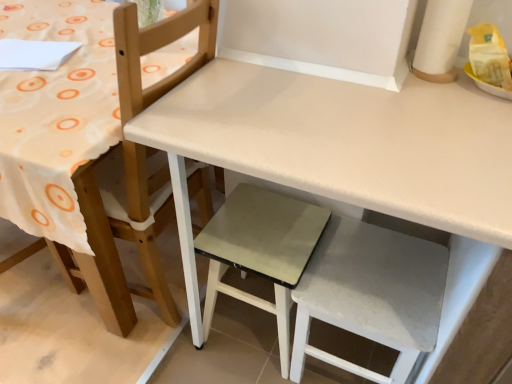
The height and width of the screenshot is (384, 512). In order to click on white fabric step stool at lower right, the 1th step stool from the right in this screenshot , I will do `click(371, 294)`.

Locate an element on the screen. This screenshot has width=512, height=384. matte gray step stool at center, acting as the second step stool starting from the right is located at coordinates [261, 250].

Locate an element on the screen. white matte table at center is located at coordinates (358, 145).

Identify the location of white fabric step stool at lower right, the 1th step stool from the right. The height and width of the screenshot is (384, 512). (371, 294).

Measure the distance from white matte chair at upper left to white matte table at center.

white matte chair at upper left is 14.92 inches from white matte table at center.

How different are the orientations of white matte chair at upper left and white matte table at center in degrees?

88.1 degrees separate the facing orientations of white matte chair at upper left and white matte table at center.

Who is bigger, white matte chair at upper left or white matte table at center?

white matte table at center is bigger.

Which of these two, white matte chair at upper left or white matte table at center, stands shorter?

Standing shorter between the two is white matte table at center.

From the image's perspective, does white matte table at center appear higher than white fabric step stool at lower right, the 1th step stool from the right?

Yes, from the image's perspective, white matte table at center is over white fabric step stool at lower right, the 1th step stool from the right.

Does white matte table at center turn towards white fabric step stool at lower right, the 1th step stool from the right?

Yes, white matte table at center is aimed at white fabric step stool at lower right, the 1th step stool from the right.

How much distance is there between white matte table at center and white fabric step stool at lower right, the 1th step stool from the right?

white matte table at center is 13.95 inches away from white fabric step stool at lower right, the 1th step stool from the right.

Does point (187, 141) come farther from viewer compared to point (292, 294)?

No, (187, 141) is closer to viewer.

Is white fabric step stool at lower right, the 1th step stool from the right, looking in the opposite direction of white matte chair at upper left?

No, white fabric step stool at lower right, the 1th step stool from the right,'s orientation is not away from white matte chair at upper left.

Between white fabric step stool at lower right, placed as the second step stool when sorted from left to right, and white matte chair at upper left, which one has larger size?

Bigger between the two is white matte chair at upper left.

From the picture: Would you say white matte chair at upper left is part of white fabric step stool at lower right, placed as the second step stool when sorted from left to right,'s contents?

No, white matte chair at upper left is not surrounded by white fabric step stool at lower right, placed as the second step stool when sorted from left to right.

Can you confirm if white fabric step stool at lower right, placed as the second step stool when sorted from left to right, is thinner than white matte chair at upper left?

Yes, white fabric step stool at lower right, placed as the second step stool when sorted from left to right, is thinner than white matte chair at upper left.

From the image's perspective, is white matte table at center positioned above or below white matte chair at upper left?

white matte table at center is situated lower than white matte chair at upper left in the image.

Considering the relative sizes of white matte table at center and white matte chair at upper left in the image provided, is white matte table at center thinner than white matte chair at upper left?

Incorrect, the width of white matte table at center is not less than that of white matte chair at upper left.

Can you confirm if white matte table at center is smaller than white matte chair at upper left?

Incorrect, white matte table at center is not smaller in size than white matte chair at upper left.

Is white matte table at center to the left or to the right of white matte chair at upper left in the image?

white matte table at center is to the right of white matte chair at upper left.

Is white matte chair at upper left facing away from matte gray step stool at center, which is the first step stool in left-to-right order?

Absolutely, white matte chair at upper left is directed away from matte gray step stool at center, which is the first step stool in left-to-right order.

Is white matte chair at upper left to the left or to the right of matte gray step stool at center, acting as the second step stool starting from the right, in the image?

From the image, it's evident that white matte chair at upper left is to the left of matte gray step stool at center, acting as the second step stool starting from the right.

How different are the orientations of white matte chair at upper left and matte gray step stool at center, which is the first step stool in left-to-right order, in degrees?

The facing directions of white matte chair at upper left and matte gray step stool at center, which is the first step stool in left-to-right order, are 87.9 degrees apart.

From a real-world perspective, which is physically above, white matte chair at upper left or matte gray step stool at center, acting as the second step stool starting from the right?

white matte chair at upper left is physically above.

Which of these two, white fabric step stool at lower right, the 1th step stool from the right, or matte gray step stool at center, acting as the second step stool starting from the right, stands taller?

Standing taller between the two is matte gray step stool at center, acting as the second step stool starting from the right.

Does white fabric step stool at lower right, the 1th step stool from the right, contain matte gray step stool at center, which is the first step stool in left-to-right order?

No.

Can you see white fabric step stool at lower right, placed as the second step stool when sorted from left to right, touching matte gray step stool at center, acting as the second step stool starting from the right?

No, white fabric step stool at lower right, placed as the second step stool when sorted from left to right, is not next to matte gray step stool at center, acting as the second step stool starting from the right.

Is point (386, 380) positioned in front of point (201, 253)?

Yes, point (386, 380) is in front of point (201, 253).

From a real-world perspective, relative to white matte chair at upper left, is matte gray step stool at center, which is the first step stool in left-to-right order, vertically above or below?

From a real-world perspective, matte gray step stool at center, which is the first step stool in left-to-right order, is physically below white matte chair at upper left.

Is matte gray step stool at center, acting as the second step stool starting from the right, thinner than white matte chair at upper left?

Correct, the width of matte gray step stool at center, acting as the second step stool starting from the right, is less than that of white matte chair at upper left.

Which object is positioned more to the left, matte gray step stool at center, which is the first step stool in left-to-right order, or white matte chair at upper left?

white matte chair at upper left is more to the left.

From the image's perspective, which one is positioned lower, matte gray step stool at center, which is the first step stool in left-to-right order, or white matte chair at upper left?

matte gray step stool at center, which is the first step stool in left-to-right order, from the image's perspective.

Identify the location of table that appears below the white matte chair at upper left (from the image's perspective). (358, 145).

In order to click on the 1st step stool behind the white matte table at center in this screenshot , I will do `click(371, 294)`.

Estimate the real-world distances between objects in this image. Which object is closer to white fabric step stool at lower right, the 1th step stool from the right, white matte table at center or matte gray step stool at center, acting as the second step stool starting from the right?

matte gray step stool at center, acting as the second step stool starting from the right.

Which object lies nearer to the anchor point white matte chair at upper left, white matte table at center or white fabric step stool at lower right, placed as the second step stool when sorted from left to right?

Based on the image, white matte table at center appears to be nearer to white matte chair at upper left.

From the image, which object appears to be nearer to white matte chair at upper left, white fabric step stool at lower right, placed as the second step stool when sorted from left to right, or white matte table at center?

white matte table at center is positioned closer to the anchor white matte chair at upper left.

Looking at the image, which one is located further to white matte table at center, white matte chair at upper left or white fabric step stool at lower right, the 1th step stool from the right?

Based on the image, white matte chair at upper left appears to be further to white matte table at center.

Which object lies nearer to the anchor point matte gray step stool at center, acting as the second step stool starting from the right, white matte table at center or white matte chair at upper left?

Among the two, white matte chair at upper left is located nearer to matte gray step stool at center, acting as the second step stool starting from the right.

When comparing their distances from white fabric step stool at lower right, the 1th step stool from the right, does white matte chair at upper left or matte gray step stool at center, acting as the second step stool starting from the right, seem further?

The object further to white fabric step stool at lower right, the 1th step stool from the right, is white matte chair at upper left.

Looking at the image, which one is located further to matte gray step stool at center, acting as the second step stool starting from the right, white matte chair at upper left or white fabric step stool at lower right, the 1th step stool from the right?

white matte chair at upper left is positioned further to the anchor matte gray step stool at center, acting as the second step stool starting from the right.

When comparing their distances from white matte table at center, does white fabric step stool at lower right, the 1th step stool from the right, or white matte chair at upper left seem closer?

white fabric step stool at lower right, the 1th step stool from the right, lies closer to white matte table at center than the other object.

Where is `step stool situated between white matte chair at upper left and white fabric step stool at lower right, the 1th step stool from the right, from left to right`? Image resolution: width=512 pixels, height=384 pixels. step stool situated between white matte chair at upper left and white fabric step stool at lower right, the 1th step stool from the right, from left to right is located at coordinates (261, 250).

The width and height of the screenshot is (512, 384). Identify the location of step stool between white matte table at center and matte gray step stool at center, acting as the second step stool starting from the right, in the front-back direction. (371, 294).